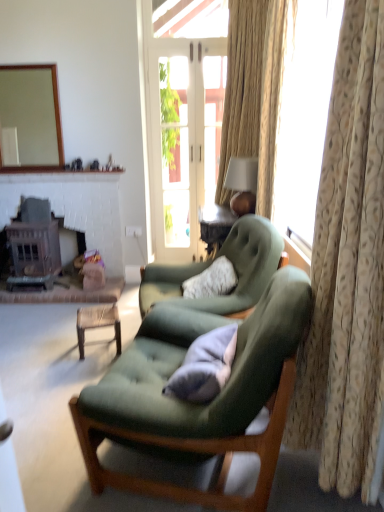
Identify the location of empty space that is ontop of rustic wood fireplace at left, which is counted as the 2th fireplace, starting from the left (from a real-world perspective). click(x=59, y=186).